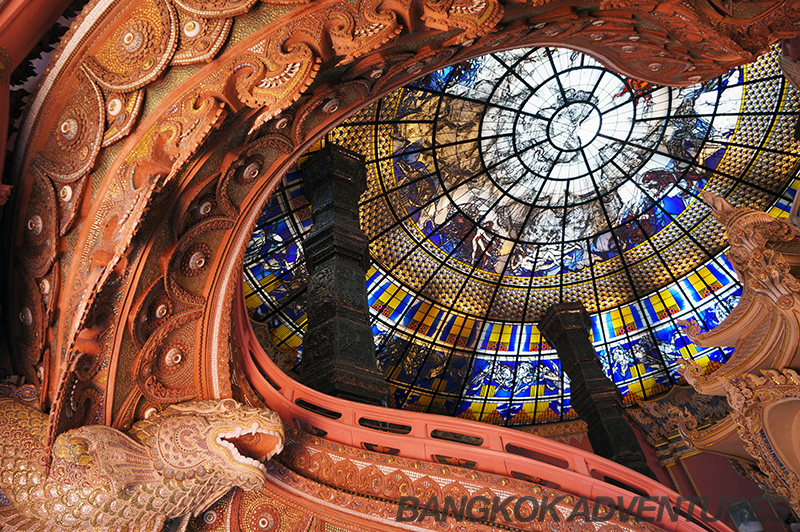
This screenshot has height=532, width=800. What are the coordinates of `gold stained glass` in the screenshot? It's located at (392, 304).